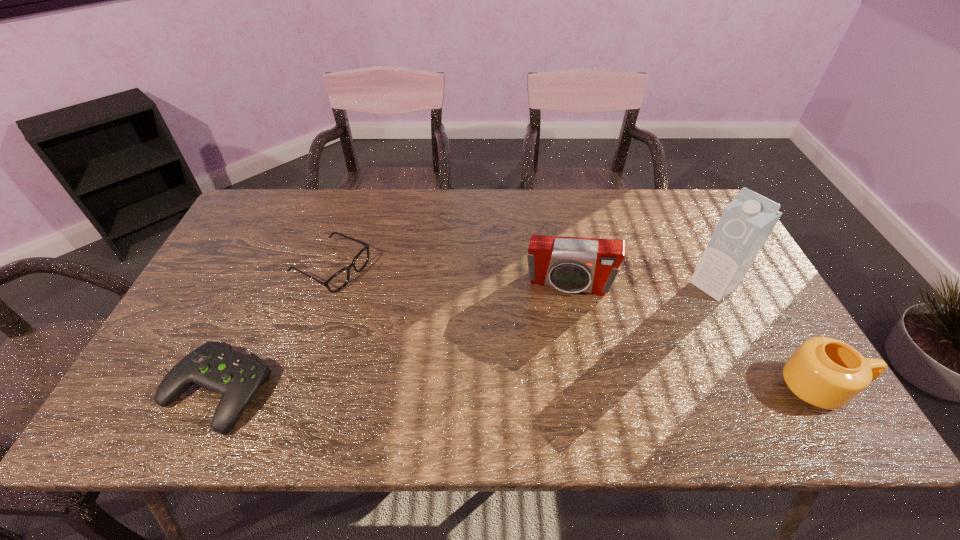
Where is `free spot on the desktop that is between the control and the mug and is positioned on the front label of the tallest object`? The image size is (960, 540). free spot on the desktop that is between the control and the mug and is positioned on the front label of the tallest object is located at coordinates (575, 389).

The width and height of the screenshot is (960, 540). Identify the location of vacant spot on the desktop that is between the control and the third shortest object and is positioned on the front-facing side of the camera. (553, 389).

At what (x,y) coordinates should I click in order to perform the action: click on vacant space on the desktop that is between the control and the third tallest object and is positioned on the front-facing side of the spectacles. Please return your answer as a coordinate pair (x, y). This screenshot has width=960, height=540. Looking at the image, I should click on (590, 389).